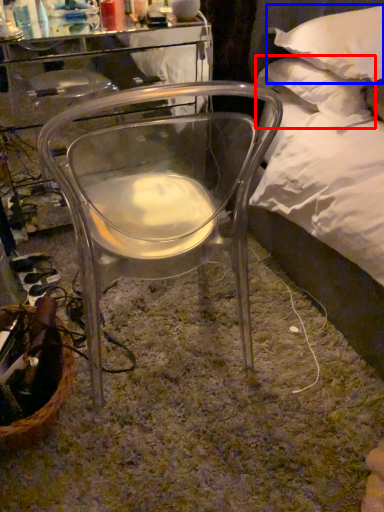
Question: Which object appears closest to the camera in this image, pillow (highlighted by a red box) or pillow (highlighted by a blue box)?

Choices:
 (A) pillow
 (B) pillow

Answer: (B)